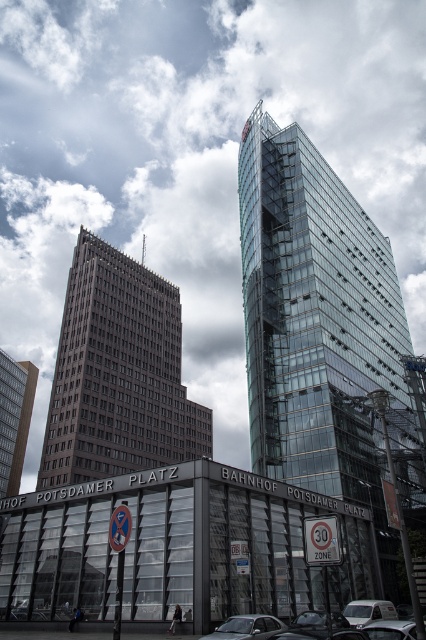
Does beige brick building at left lie behind silver metallic car at lower center?

Yes, beige brick building at left is behind silver metallic car at lower center.

Does beige brick building at left have a lesser width compared to silver metallic car at lower center?

No.

What do you see at coordinates (14, 419) in the screenshot? I see `beige brick building at left` at bounding box center [14, 419].

This screenshot has width=426, height=640. In order to click on beige brick building at left in this screenshot , I will do `click(14, 419)`.

Does metallic silver car at lower center lie in front of silver metallic car at lower right?

No, metallic silver car at lower center is behind silver metallic car at lower right.

Is metallic silver car at lower center thinner than silver metallic car at lower right?

In fact, metallic silver car at lower center might be wider than silver metallic car at lower right.

The height and width of the screenshot is (640, 426). I want to click on metallic silver car at lower center, so click(x=247, y=627).

Can you confirm if brown brick building at center is thinner than metallic silver car at lower center?

Incorrect, brown brick building at center's width is not less than metallic silver car at lower center's.

What do you see at coordinates (118, 372) in the screenshot?
I see `brown brick building at center` at bounding box center [118, 372].

Where is `brown brick building at center`? This screenshot has height=640, width=426. brown brick building at center is located at coordinates (118, 372).